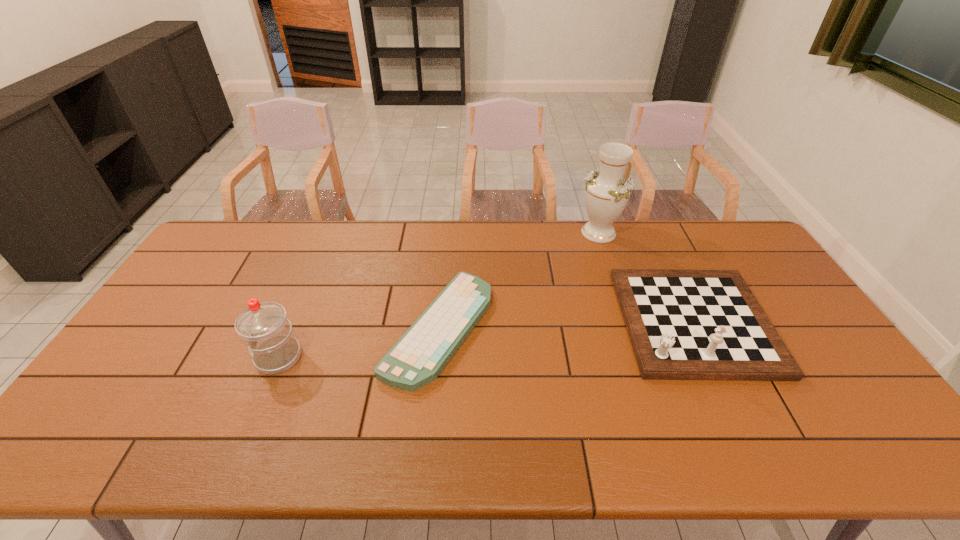
In the image, there is a desktop. At what (x,y) coordinates should I click in order to perform the action: click on vacant space at the near right corner. Please return your answer as a coordinate pair (x, y). Looking at the image, I should click on (822, 429).

Where is `vacant space that's between the tallest object and the computer keyboard`? This screenshot has height=540, width=960. vacant space that's between the tallest object and the computer keyboard is located at coordinates (518, 280).

Locate an element on the screen. This screenshot has height=540, width=960. vacant point located between the third tallest object and the water bottle is located at coordinates (486, 340).

Find the location of a particular element. The image size is (960, 540). free space between the second object from left to right and the leftmost object is located at coordinates (359, 342).

This screenshot has width=960, height=540. Find the location of `free space that is in between the vase and the shortest object`. free space that is in between the vase and the shortest object is located at coordinates (518, 280).

The height and width of the screenshot is (540, 960). In order to click on vacant area between the computer keyboard and the water bottle in this screenshot , I will do `click(359, 342)`.

The width and height of the screenshot is (960, 540). Identify the location of free space that is in between the gameboard and the second object from left to right. (566, 325).

Where is `free space between the leftmost object and the gameboard`? This screenshot has width=960, height=540. free space between the leftmost object and the gameboard is located at coordinates (486, 340).

Select which object is the closest to the farthest object. Please provide its 2D coordinates. Your answer should be formatted as a tuple, i.e. [(x, y)], where the tuple contains the x and y coordinates of a point satisfying the conditions above.

[(683, 324)]

Identify which object is the second closest to the shortest object. Please provide its 2D coordinates. Your answer should be formatted as a tuple, i.e. [(x, y)], where the tuple contains the x and y coordinates of a point satisfying the conditions above.

[(607, 192)]